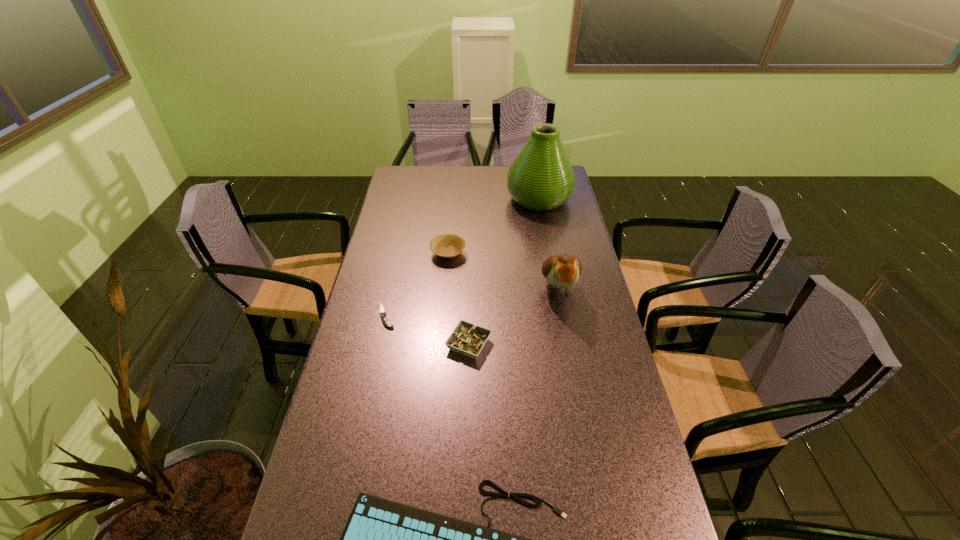
Where is `free location at the far left corner of the desktop`? Image resolution: width=960 pixels, height=540 pixels. free location at the far left corner of the desktop is located at coordinates (425, 166).

Image resolution: width=960 pixels, height=540 pixels. I want to click on empty space that is in between the tallest object and the shortest object, so click(462, 257).

I want to click on free spot between the ashtray and the tallest object, so click(504, 272).

Where is `blank region between the bird and the second farthest object`? Image resolution: width=960 pixels, height=540 pixels. blank region between the bird and the second farthest object is located at coordinates (503, 271).

Where is `unoccupied position between the ashtray and the pocketknife`? The image size is (960, 540). unoccupied position between the ashtray and the pocketknife is located at coordinates (427, 330).

Where is `vacant space that is in between the second farthest object and the shortest object`? The width and height of the screenshot is (960, 540). vacant space that is in between the second farthest object and the shortest object is located at coordinates (417, 285).

Locate an element on the screen. The image size is (960, 540). vacant area that lies between the shortest object and the bird is located at coordinates (471, 302).

You are a GUI agent. You are given a task and a screenshot of the screen. Output one action in this format:
    pyautogui.click(x=<x>, y=<y>)
    Task: Click on the free space between the second farthest object and the vase
    The height and width of the screenshot is (540, 960).
    Given the screenshot: What is the action you would take?
    pyautogui.click(x=493, y=226)

Find the location of a particular element. unoccupied area between the fifth shortest object and the ashtray is located at coordinates (514, 316).

Identify the location of vacant region between the bird and the shortest object. tap(471, 302).